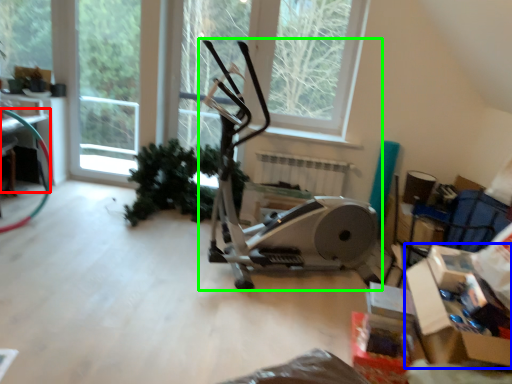
Question: Based on their relative distances, which object is nearer to table (highlighted by a red box)? Choose from cardboard box (highlighted by a blue box) and stationary bicycle (highlighted by a green box).

Choices:
 (A) cardboard box
 (B) stationary bicycle

Answer: (B)